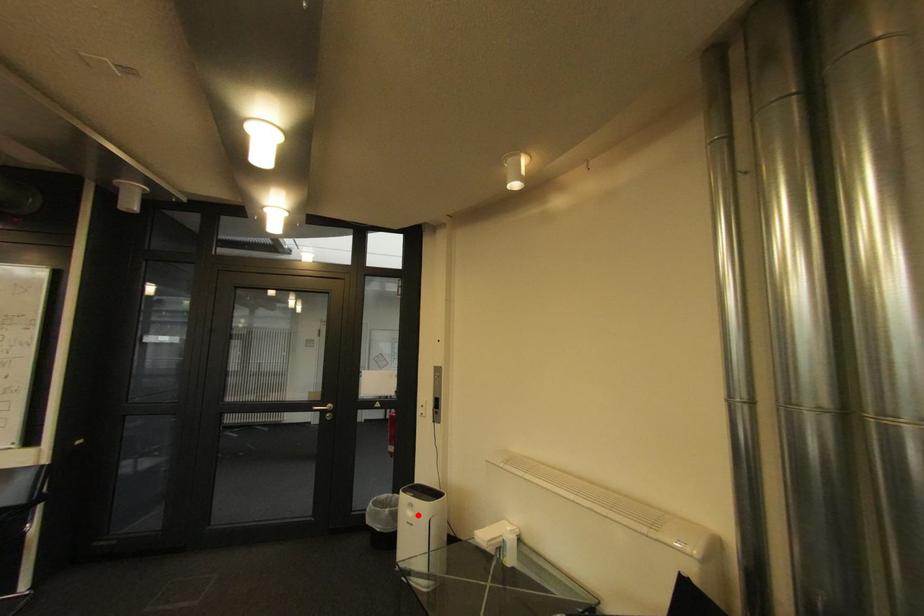
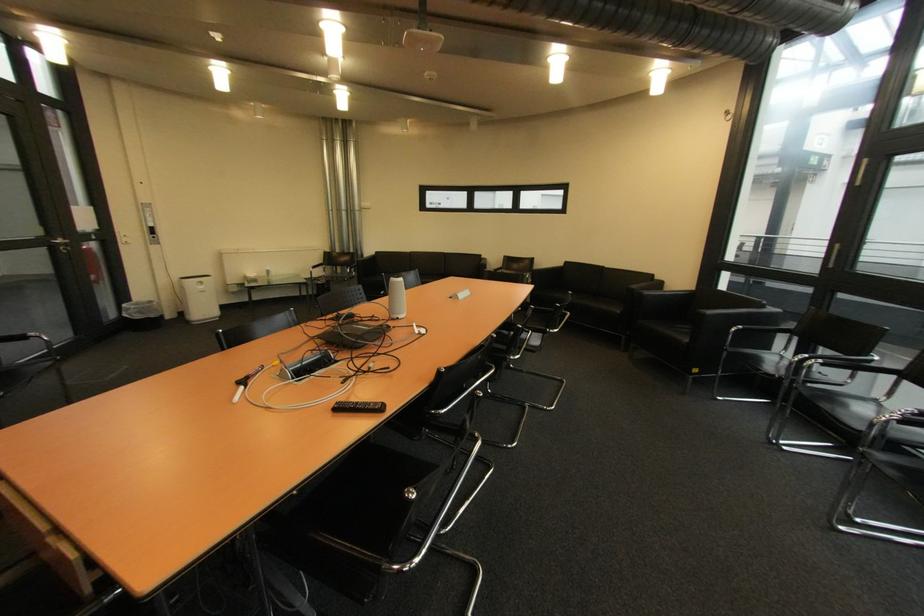
The point at the highlighted location is marked in the first image. Where is the corresponding point in the second image?

(209, 288)